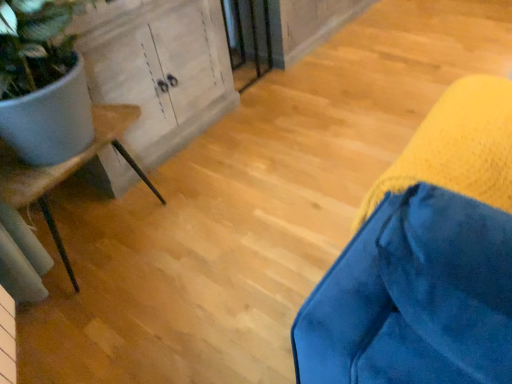
Locate an element on the screen. The image size is (512, 384). spots to the right of white matte plant pot at left, arranged as the 1th furniture when viewed from the left is located at coordinates [225, 219].